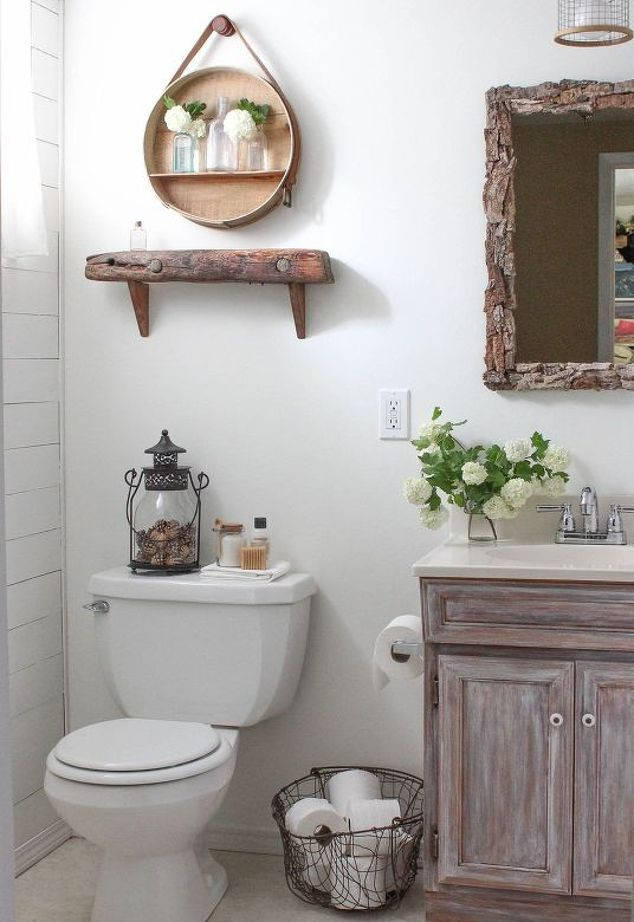
The height and width of the screenshot is (922, 634). I want to click on back wall, so [86, 657], [335, 686], [402, 149], [89, 128].